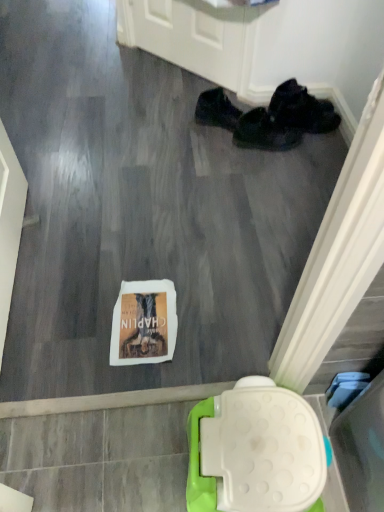
Question: Is black fabric shoe at upper right, which appears as the first footwear when viewed from the left, next to black fabric shoes at upper right, which is the 3th footwear in left-to-right order?

Choices:
 (A) yes
 (B) no

Answer: (B)

Question: Is the position of black fabric shoe at upper right, the third footwear viewed from the right, more distant than that of black fabric shoes at upper right, the 1th footwear when ordered from right to left?

Choices:
 (A) yes
 (B) no

Answer: (B)

Question: From a real-world perspective, does black fabric shoe at upper right, the third footwear viewed from the right, sit lower than black fabric shoes at upper right, the 1th footwear when ordered from right to left?

Choices:
 (A) yes
 (B) no

Answer: (A)

Question: Is black fabric shoe at upper right, which appears as the first footwear when viewed from the left, positioned far away from black fabric shoes at upper right, the 1th footwear when ordered from right to left?

Choices:
 (A) no
 (B) yes

Answer: (A)

Question: From the image's perspective, is black fabric shoe at upper right, which appears as the first footwear when viewed from the left, under black fabric shoes at upper right, which is the 3th footwear in left-to-right order?

Choices:
 (A) no
 (B) yes

Answer: (B)

Question: Considering the positions of point (271, 113) and point (317, 117), is point (271, 113) closer or farther from the camera than point (317, 117)?

Choices:
 (A) farther
 (B) closer

Answer: (B)

Question: Is black fabric shoes at center, the second footwear positioned from the left, situated inside black fabric shoes at upper right, which is the 3th footwear in left-to-right order, or outside?

Choices:
 (A) inside
 (B) outside

Answer: (B)

Question: Considering their positions, is black fabric shoes at center, positioned as the 2th footwear in right-to-left order, located in front of or behind black fabric shoes at upper right, which is the 3th footwear in left-to-right order?

Choices:
 (A) front
 (B) behind

Answer: (A)

Question: Looking at their shapes, would you say black fabric shoes at center, positioned as the 2th footwear in right-to-left order, is wider or thinner than black fabric shoes at upper right, the 1th footwear when ordered from right to left?

Choices:
 (A) wide
 (B) thin

Answer: (B)

Question: Considering the positions of black fabric shoe at upper right, which appears as the first footwear when viewed from the left, and black fabric shoes at upper right, which is the 3th footwear in left-to-right order, in the image, is black fabric shoe at upper right, which appears as the first footwear when viewed from the left, wider or thinner than black fabric shoes at upper right, which is the 3th footwear in left-to-right order,?

Choices:
 (A) wide
 (B) thin

Answer: (B)

Question: From the image's perspective, is black fabric shoe at upper right, which appears as the first footwear when viewed from the left, positioned above or below black fabric shoes at upper right, which is the 3th footwear in left-to-right order?

Choices:
 (A) above
 (B) below

Answer: (B)

Question: Considering the positions of black fabric shoe at upper right, the third footwear viewed from the right, and black fabric shoes at upper right, the 1th footwear when ordered from right to left, in the image, is black fabric shoe at upper right, the third footwear viewed from the right, taller or shorter than black fabric shoes at upper right, the 1th footwear when ordered from right to left,?

Choices:
 (A) short
 (B) tall

Answer: (B)

Question: From a real-world perspective, is black fabric shoe at upper right, the third footwear viewed from the right, positioned above or below black fabric shoes at upper right, which is the 3th footwear in left-to-right order?

Choices:
 (A) above
 (B) below

Answer: (B)

Question: Is black fabric shoes at upper right, which is the 3th footwear in left-to-right order, inside the boundaries of black fabric shoes at center, the second footwear positioned from the left, or outside?

Choices:
 (A) inside
 (B) outside

Answer: (B)

Question: From the image's perspective, is black fabric shoes at upper right, which is the 3th footwear in left-to-right order, above or below black fabric shoes at center, positioned as the 2th footwear in right-to-left order?

Choices:
 (A) above
 (B) below

Answer: (A)